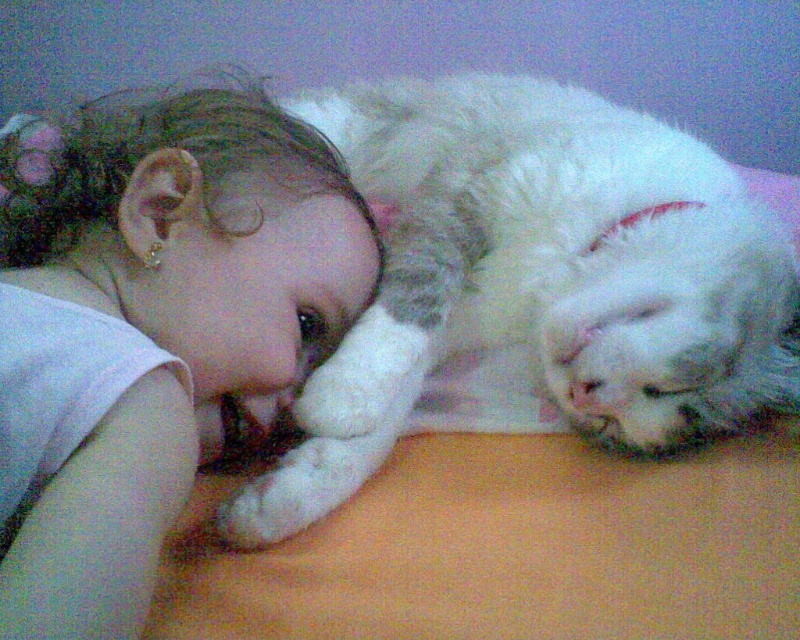
Between point (2, 172) and point (590, 193), which one is positioned behind?

Point (2, 172)

Between smooth skin baby at center and white fluffy cat at upper right, which one has more height?

white fluffy cat at upper right is taller.

Is point (124, 512) positioned behind point (688, 396)?

No, (124, 512) is closer to viewer.

Locate an element on the screen. This screenshot has height=640, width=800. smooth skin baby at center is located at coordinates (152, 328).